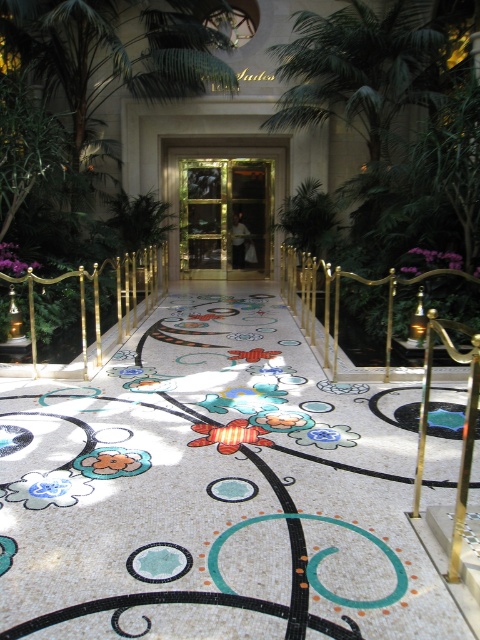
You are standing in the luxurious entrance area and want to place a small decorative item exactly halfway between the two points, point (x=240, y=268) and point (x=290, y=284). Considering their positions relative to the camera, will the midpoint be closer to the mosaic floor or the entrance doors?

The midpoint between point (x=240, y=268) and point (x=290, y=284) will be closer to the entrance doors because point (x=240, y=268) is closer to the camera than point (x=290, y=284). Since the midpoint is calculated based on their coordinates, the position relative to the camera means the midpoint leans towards the point further away, which is point (x=290, y=284) near the entrance doors.

Consider the image. You are a guest approaching the entrance of a hotel and see the white mosaic floor at center and the gold polished metal railing at center. Which object is closer to the entrance doors?

The gold polished metal railing at center is closer to the entrance doors because the white mosaic floor at center is below it, indicating the railing is positioned in front of the floor near the entrance.

You are designing a layout for a new hotel entrance. The scene shows a white mosaic floor at center and a gold polished metal railing at center. Which object takes up more space in the entrance area?

The gold polished metal railing at center occupies more space than the white mosaic floor at center, as stated in the description.